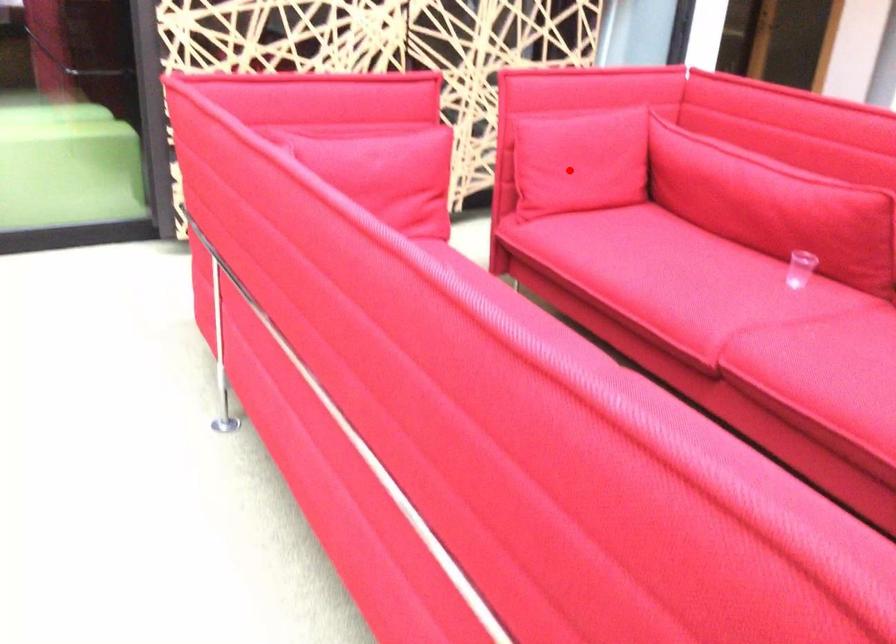
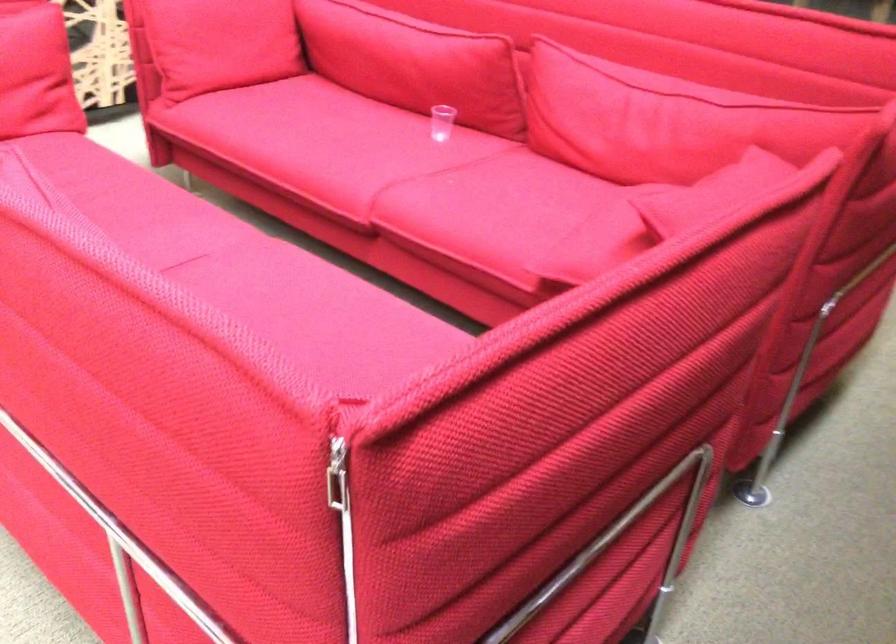
Locate, in the second image, the point that corresponds to the highlighted location in the first image.

(220, 43)